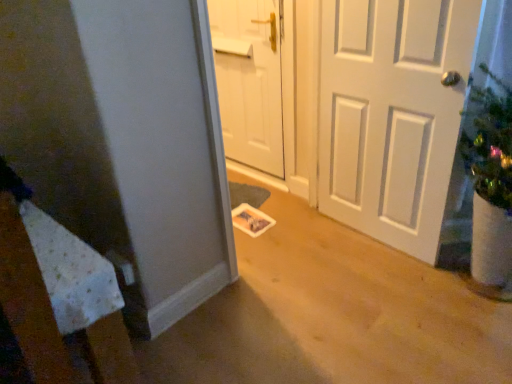
Question: Is white matte door at right, the 2th door from the left, in front of or behind white matte door at center, placed as the 1th door when sorted from left to right, in the image?

Choices:
 (A) behind
 (B) front

Answer: (B)

Question: From the image's perspective, is white matte door at right, the 2th door from the left, positioned above or below white matte door at center, which appears as the 2th door when viewed from the right?

Choices:
 (A) above
 (B) below

Answer: (B)

Question: Visually, is white matte door at right, the 2th door from the left, positioned to the left or to the right of white matte door at center, which appears as the 2th door when viewed from the right?

Choices:
 (A) left
 (B) right

Answer: (B)

Question: Which is correct: white matte door at center, which appears as the 2th door when viewed from the right, is inside white matte door at right, which ranks as the 1th door in right-to-left order, or outside of it?

Choices:
 (A) inside
 (B) outside

Answer: (B)

Question: Is point (275, 41) positioned closer to the camera than point (412, 253)?

Choices:
 (A) farther
 (B) closer

Answer: (A)

Question: Relative to white matte door at right, which ranks as the 1th door in right-to-left order, is white matte door at center, which appears as the 2th door when viewed from the right, in front or behind?

Choices:
 (A) behind
 (B) front

Answer: (A)

Question: Is white matte door at center, which appears as the 2th door when viewed from the right, bigger or smaller than white matte door at right, the 2th door from the left?

Choices:
 (A) big
 (B) small

Answer: (B)